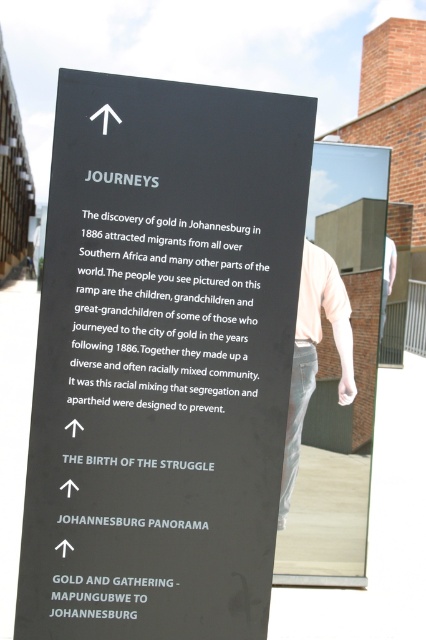
Which of these two, black matte sign at upper center or white cotton shirt at center, stands shorter?

black matte sign at upper center is shorter.

Can you confirm if black matte sign at upper center is positioned below white cotton shirt at center?

Actually, black matte sign at upper center is above white cotton shirt at center.

Is point (40, 589) closer to camera compared to point (310, 282)?

Yes, it is.

Locate an element on the screen. black matte sign at upper center is located at coordinates (161, 358).